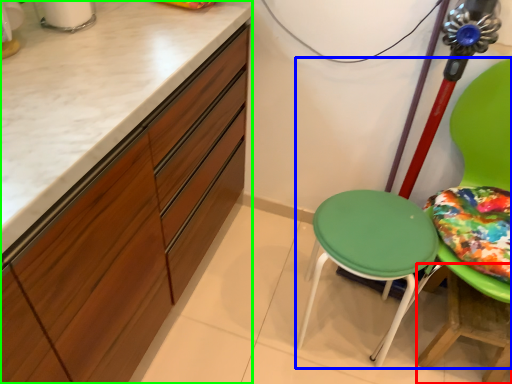
Question: Estimate the real-world distances between objects in this image. Which object is farther from table (highlighted by a red box), chair (highlighted by a blue box) or cabinetry (highlighted by a green box)?

Choices:
 (A) chair
 (B) cabinetry

Answer: (B)